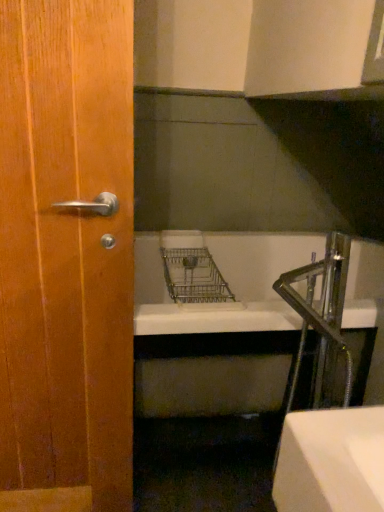
You are a GUI agent. You are given a task and a screenshot of the screen. Output one action in this format:
    pyautogui.click(x=<x>, y=<y>)
    Task: Click on the wooden door handle at left
    This screenshot has height=512, width=384.
    Given the screenshot: What is the action you would take?
    pyautogui.click(x=66, y=256)

What do you see at coordinates (66, 256) in the screenshot?
I see `wooden door handle at left` at bounding box center [66, 256].

This screenshot has height=512, width=384. What do you see at coordinates (321, 316) in the screenshot? I see `chrome metallic faucet at right` at bounding box center [321, 316].

Image resolution: width=384 pixels, height=512 pixels. Identify the location of chrome metallic faucet at right. (321, 316).

This screenshot has height=512, width=384. I want to click on wooden door handle at left, so click(66, 256).

Does wooden door handle at left appear on the right side of chrome metallic faucet at right?

Incorrect, wooden door handle at left is not on the right side of chrome metallic faucet at right.

Which object is further away from the camera, wooden door handle at left or chrome metallic faucet at right?

Positioned behind is chrome metallic faucet at right.

Which point is more forward, [125,124] or [325,339]?

The point [125,124] is more forward.

From the image's perspective, between wooden door handle at left and chrome metallic faucet at right, who is located below?

From the image's view, chrome metallic faucet at right is below.

From a real-world perspective, is wooden door handle at left over chrome metallic faucet at right?

Correct, in the physical world, wooden door handle at left is higher than chrome metallic faucet at right.

Between wooden door handle at left and chrome metallic faucet at right, which one has smaller width?

wooden door handle at left.

From the picture: Which of these two, wooden door handle at left or chrome metallic faucet at right, stands taller?

wooden door handle at left.

Who is smaller, wooden door handle at left or chrome metallic faucet at right?

Smaller between the two is chrome metallic faucet at right.

Is chrome metallic faucet at right inside wooden door handle at left?

No, chrome metallic faucet at right is not a part of wooden door handle at left.

Based on the photo, is wooden door handle at left positioned far away from chrome metallic faucet at right?

That's not correct — wooden door handle at left is a little close to chrome metallic faucet at right.

Is wooden door handle at left oriented towards chrome metallic faucet at right?

No, wooden door handle at left is not turned towards chrome metallic faucet at right.

What's the angular difference between wooden door handle at left and chrome metallic faucet at right's facing directions?

90.4 degrees separate the facing orientations of wooden door handle at left and chrome metallic faucet at right.

How far apart are wooden door handle at left and chrome metallic faucet at right?

wooden door handle at left is 24.38 inches away from chrome metallic faucet at right.

This screenshot has width=384, height=512. Identify the location of faucet behind the wooden door handle at left. (321, 316).

Is chrome metallic faucet at right to the right of wooden door handle at left from the viewer's perspective?

Indeed, chrome metallic faucet at right is positioned on the right side of wooden door handle at left.

Is chrome metallic faucet at right behind wooden door handle at left?

That is True.

Considering the positions of point (336, 281) and point (30, 301), is point (336, 281) closer or farther from the camera than point (30, 301)?

Point (336, 281) appears to be farther away from the viewer than point (30, 301).

From the image's perspective, is chrome metallic faucet at right positioned above or below wooden door handle at left?

Based on their image positions, chrome metallic faucet at right is located beneath wooden door handle at left.

From a real-world perspective, is chrome metallic faucet at right physically located above or below wooden door handle at left?

From a real-world perspective, chrome metallic faucet at right is physically below wooden door handle at left.

In terms of width, does chrome metallic faucet at right look wider or thinner when compared to wooden door handle at left?

In the image, chrome metallic faucet at right appears to be wider than wooden door handle at left.

Consider the image. Is chrome metallic faucet at right taller than wooden door handle at left?

Incorrect, the height of chrome metallic faucet at right is not larger of that of wooden door handle at left.

Consider the image. Between chrome metallic faucet at right and wooden door handle at left, which one has smaller size?

Smaller between the two is chrome metallic faucet at right.

Is chrome metallic faucet at right situated inside wooden door handle at left or outside?

chrome metallic faucet at right is located beyond the bounds of wooden door handle at left.

Is chrome metallic faucet at right next to wooden door handle at left?

chrome metallic faucet at right and wooden door handle at left are clearly separated.

Based on the photo, is chrome metallic faucet at right oriented towards wooden door handle at left?

Yes, chrome metallic faucet at right is turned towards wooden door handle at left.

How many degrees apart are the facing directions of chrome metallic faucet at right and wooden door handle at left?

90.4 degrees.

Find the location of a particular element. faucet lying below the wooden door handle at left (from the image's perspective) is located at coordinates (321, 316).

Find the location of `faucet below the wooden door handle at left (from the image's perspective)`. faucet below the wooden door handle at left (from the image's perspective) is located at coordinates (321, 316).

This screenshot has height=512, width=384. I want to click on faucet on the right of wooden door handle at left, so click(321, 316).